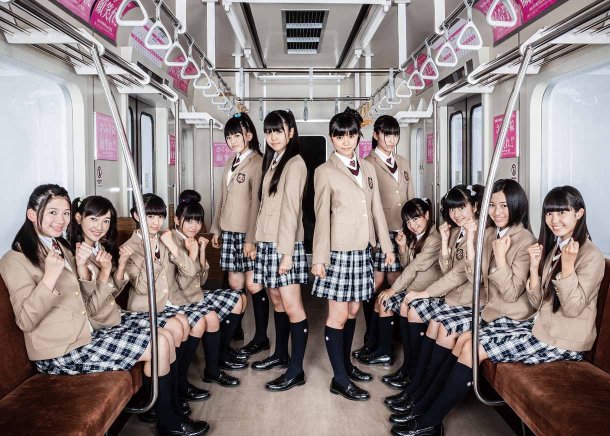
In order to click on vents in this screenshot , I will do `click(310, 28)`.